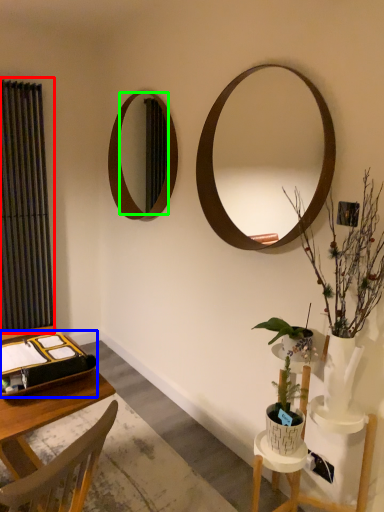
Question: Estimate the real-world distances between objects in this image. Which object is farther from curtain (highlighted by a red box), binder (highlighted by a blue box) or mirror (highlighted by a green box)?

Choices:
 (A) binder
 (B) mirror

Answer: (A)